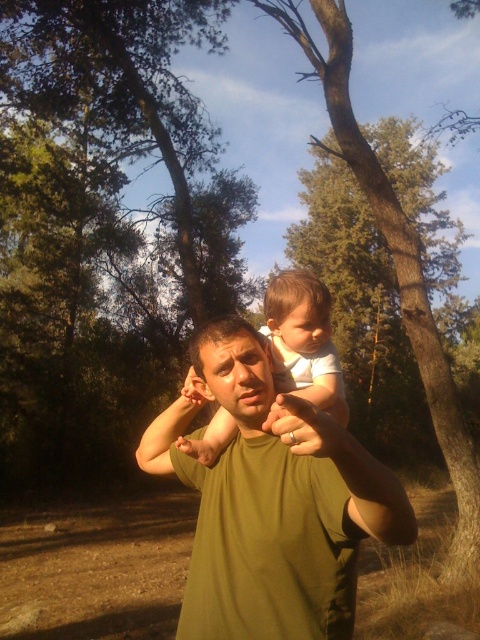
You are a photographer trying to capture the scene where the green matte shirt at center and the white cotton baby at center are both visible. Since you want to ensure both subjects are in focus, which subject should you focus on to ensure the other is also in focus due to their spatial arrangement?

The green matte shirt at center is positioned on the left side of white cotton baby at center, so focusing on the white cotton baby at center would ensure both are in focus since it is closer to the camera.

From the picture: You are a photographer trying to capture the scene where the man is pointing at something. To ensure the green matte shirt at center is perfectly framed, where should you position your camera relative to the shirt?

The green matte shirt at center is positioned at coordinates point (272, 502), so you should aim your camera to focus on that point to frame it perfectly.

You are a photographer standing at a certain distance from the man in the green matte shirt at center. You want to take a photo where the subject fills the frame perfectly. If your camera has a focal length of 50mm and the recommended subject distance for optimal framing is 40 inches, should you move closer or farther away?

The green matte shirt at center is currently 37.81 inches away from the camera. Since the recommended distance is 40 inches, you should move slightly farther away to achieve the optimal framing.